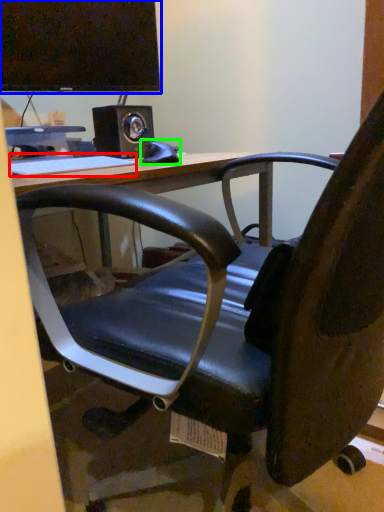
Question: Based on their relative distances, which object is farther from keyboard (highlighted by a red box)? Choose from computer monitor (highlighted by a blue box) and equipment (highlighted by a green box).

Choices:
 (A) computer monitor
 (B) equipment

Answer: (A)